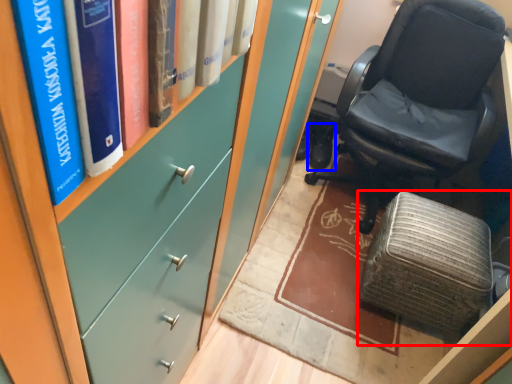
Question: Which object appears farthest to the camera in this image, furniture (highlighted by a red box) or footwear (highlighted by a blue box)?

Choices:
 (A) furniture
 (B) footwear

Answer: (B)